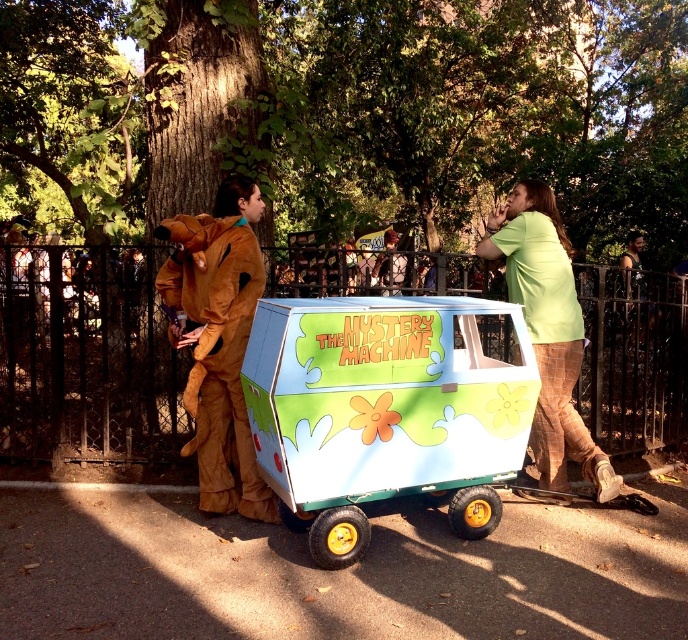
Between green painted wood mystery machine at center and green plaid pants at right, which one appears on the right side from the viewer's perspective?

green plaid pants at right

Is point (464, 465) positioned before point (558, 336)?

That is True.

The width and height of the screenshot is (688, 640). Find the location of `green painted wood mystery machine at center`. green painted wood mystery machine at center is located at coordinates click(x=387, y=410).

In the scene shown: Is green painted wood mystery machine at center closer to camera compared to brown furry costume at center?

Yes, it is.

Between point (386, 422) and point (197, 444), which one is positioned in front?

Point (386, 422) is in front.

Which is in front, point (413, 337) or point (213, 410)?

Positioned in front is point (413, 337).

You are a GUI agent. You are given a task and a screenshot of the screen. Output one action in this format:
    pyautogui.click(x=<x>, y=<y>)
    Task: Click on the green painted wood mystery machine at center
    This screenshot has height=640, width=688.
    Given the screenshot: What is the action you would take?
    pyautogui.click(x=387, y=410)

The height and width of the screenshot is (640, 688). Find the location of `brown furry costume at center`. brown furry costume at center is located at coordinates (217, 339).

Who is lower down, brown furry costume at center or green plaid pants at right?

brown furry costume at center is lower down.

Describe the element at coordinates (217, 339) in the screenshot. I see `brown furry costume at center` at that location.

Locate an element on the screen. The width and height of the screenshot is (688, 640). brown furry costume at center is located at coordinates (217, 339).